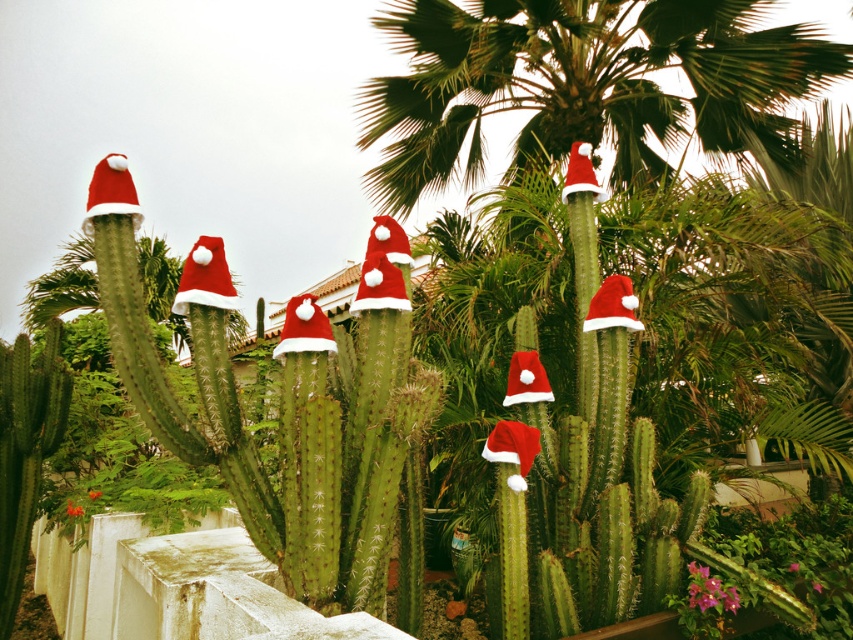
Question: Observing the image, what is the correct spatial positioning of red matte santa hat at center in reference to red matte santa hat at upper center?

Choices:
 (A) right
 (B) left

Answer: (B)

Question: Which point is farther from the camera taking this photo?

Choices:
 (A) (399, 280)
 (B) (625, 296)
 (C) (585, 156)

Answer: (C)

Question: Among these objects, which one is farthest from the camera?

Choices:
 (A) red matte santa hat at upper center
 (B) red matte santa hat at center

Answer: (A)

Question: Can you confirm if red matte santa hat at center is positioned below red matte santa hat at upper center?

Choices:
 (A) no
 (B) yes

Answer: (B)

Question: Which object is closer to the camera taking this photo?

Choices:
 (A) red matte santa hat at upper center
 (B) red fabric santa hat at center

Answer: (B)

Question: Can you confirm if red matte santa hat at center is positioned below red matte santa hat at upper center?

Choices:
 (A) yes
 (B) no

Answer: (A)